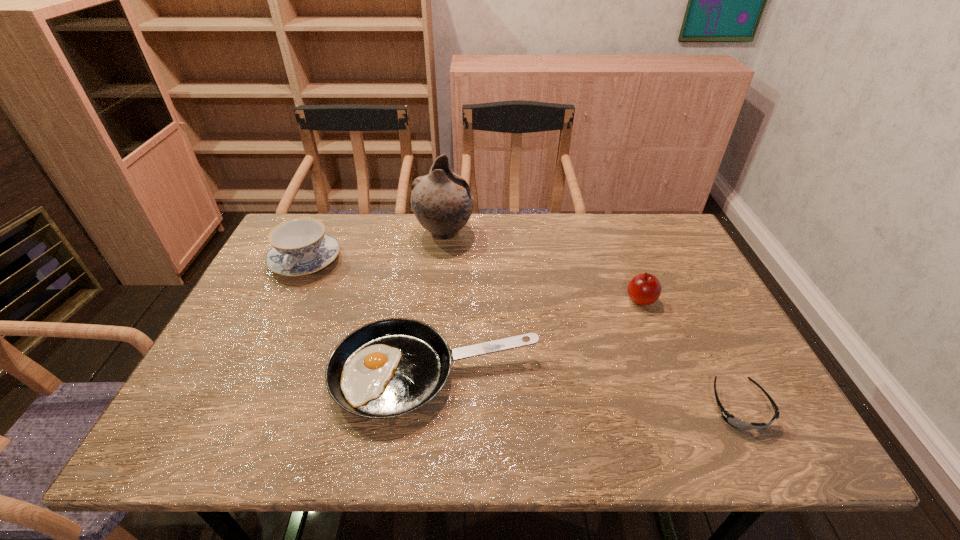
This screenshot has width=960, height=540. I want to click on vacant area that lies between the pottery and the frying pan, so click(440, 303).

The width and height of the screenshot is (960, 540). I want to click on empty space between the tallest object and the chinaware, so click(x=375, y=247).

Find the location of a particular element. the third closest object to the sunglasses is located at coordinates tap(442, 201).

Identify which object is the closest to the rightmost object. Please provide its 2D coordinates. Your answer should be formatted as a tuple, i.e. [(x, y)], where the tuple contains the x and y coordinates of a point satisfying the conditions above.

[(644, 289)]

Find the location of a particular element. free region that satisfies the following two spatial constraints: 1. on the back side of the frying pan; 2. from the spout of the pottery is located at coordinates point(448,233).

Locate an element on the screen. free space that satisfies the following two spatial constraints: 1. on the back side of the third farthest object; 2. on the right side of the fourth tallest object is located at coordinates (443, 300).

This screenshot has height=540, width=960. In order to click on free space that satisfies the following two spatial constraints: 1. from the spout of the apple; 2. on the right side of the tallest object in this screenshot , I will do `click(438, 300)`.

This screenshot has width=960, height=540. What are the coordinates of `free space that satisfies the following two spatial constraints: 1. with the handle on the side of the chinaware; 2. on the right side of the second shortest object` in the screenshot? It's located at (252, 374).

This screenshot has width=960, height=540. I want to click on vacant area in the image that satisfies the following two spatial constraints: 1. from the spout of the pottery; 2. on the left side of the frying pan, so click(x=430, y=374).

Where is `vacant point that satisfies the following two spatial constraints: 1. from the spout of the apple; 2. on the right side of the tallest object`? vacant point that satisfies the following two spatial constraints: 1. from the spout of the apple; 2. on the right side of the tallest object is located at coordinates (438, 300).